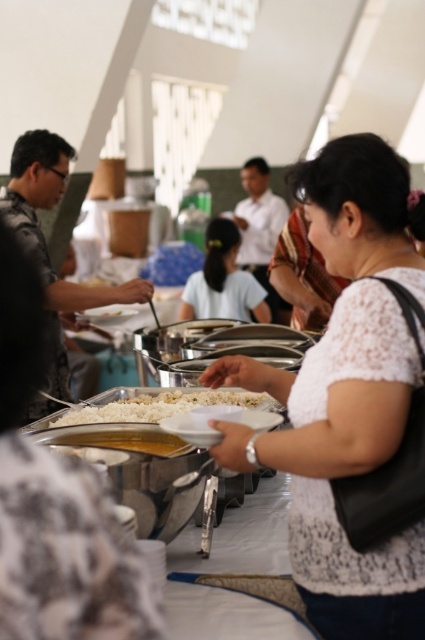
Does white matte rice at center come in front of yellow matte sauce at center?

Yes, white matte rice at center is in front of yellow matte sauce at center.

Between point (183, 468) and point (68, 440), which one is positioned behind?

The point (68, 440) is more distant.

Where is `white matte rice at center`? This screenshot has width=425, height=640. white matte rice at center is located at coordinates (147, 470).

From the picture: Is white matte rice at center wider than white rice at center?

Yes.

Which is above, white matte rice at center or white rice at center?

white rice at center is above.

Who is more distant from viewer, (183, 474) or (74, 410)?

Point (74, 410)

The image size is (425, 640). Find the location of `white matte rice at center`. white matte rice at center is located at coordinates (147, 470).

Does white matte rice at center have a greater width compared to white lace shirt at center?

No, white matte rice at center is not wider than white lace shirt at center.

Consider the image. Measure the distance between point (155, 449) and camera.

The distance of point (155, 449) from camera is 2.16 meters.

This screenshot has height=640, width=425. Find the location of `white matte rice at center`. white matte rice at center is located at coordinates coord(147,470).